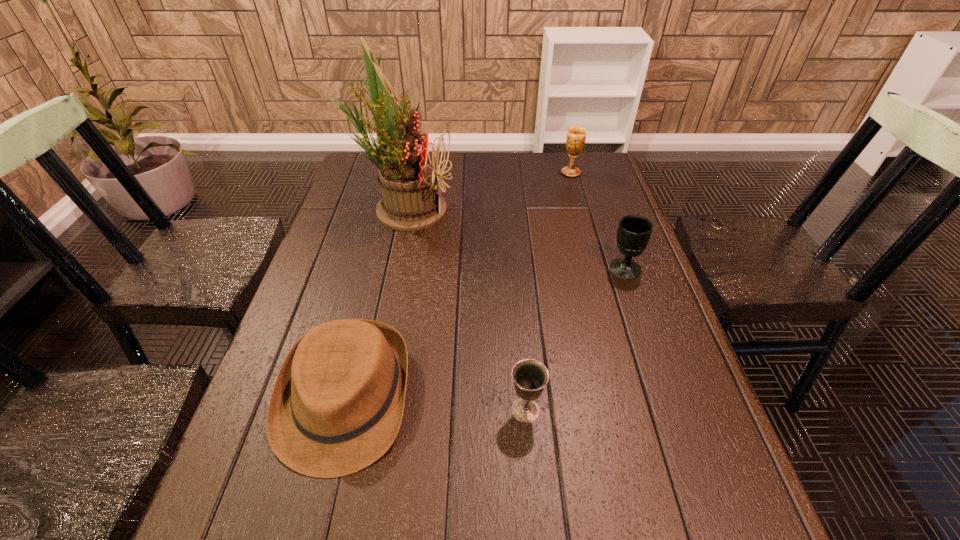
Locate an element on the screen. Image resolution: width=960 pixels, height=540 pixels. flower arrangement is located at coordinates (408, 180).

Where is `the tallest object`? The height and width of the screenshot is (540, 960). the tallest object is located at coordinates (408, 180).

Locate an element on the screen. This screenshot has width=960, height=540. the farthest chalice is located at coordinates (576, 136).

Find the location of a particular element. The width and height of the screenshot is (960, 540). the second farthest chalice is located at coordinates (634, 231).

Locate an element on the screen. the third object from right to left is located at coordinates (530, 376).

I want to click on the nearest chalice, so click(x=530, y=376).

At what (x,y) coordinates should I click in order to perform the action: click on fedora. Please return your answer as a coordinate pair (x, y). Looking at the image, I should click on (337, 404).

Where is `vacant position located in front of the second farthest object with the fan visible`? This screenshot has width=960, height=540. vacant position located in front of the second farthest object with the fan visible is located at coordinates (541, 208).

Where is `vacant space located on the front of the farthest chalice`? This screenshot has height=540, width=960. vacant space located on the front of the farthest chalice is located at coordinates (588, 234).

I want to click on free spot located 0.360m on the back of the third nearest object, so tap(595, 185).